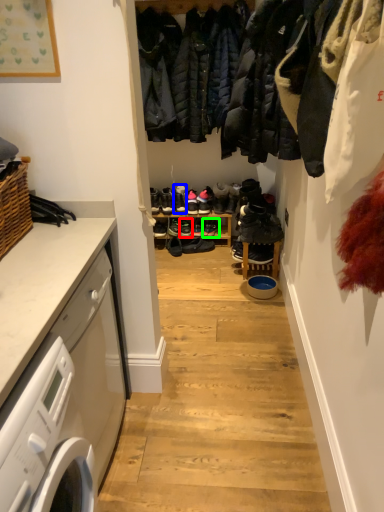
Question: Which object is the closest to the footwear (highlighted by a red box)? Choose among these: footwear (highlighted by a blue box) or footwear (highlighted by a green box).

Choices:
 (A) footwear
 (B) footwear

Answer: (B)